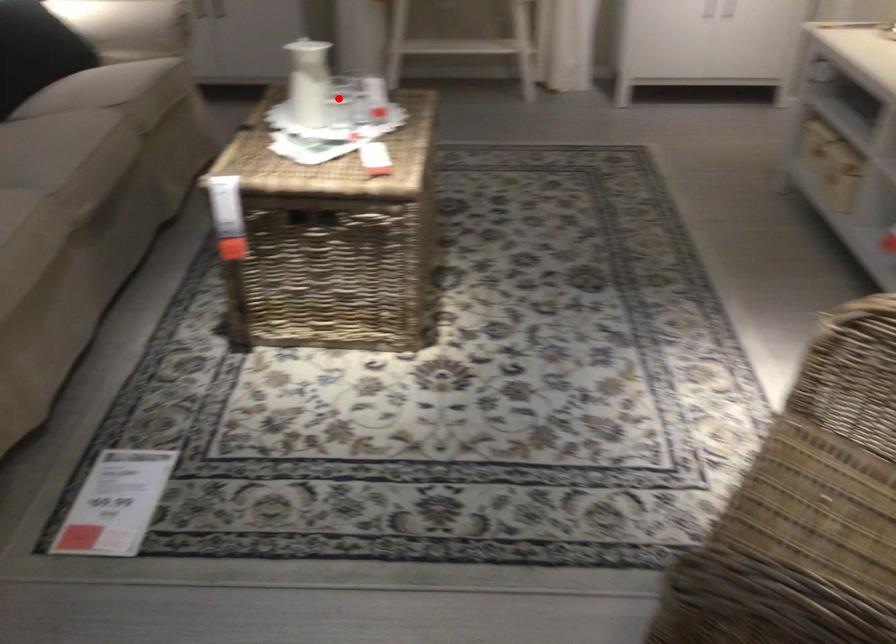
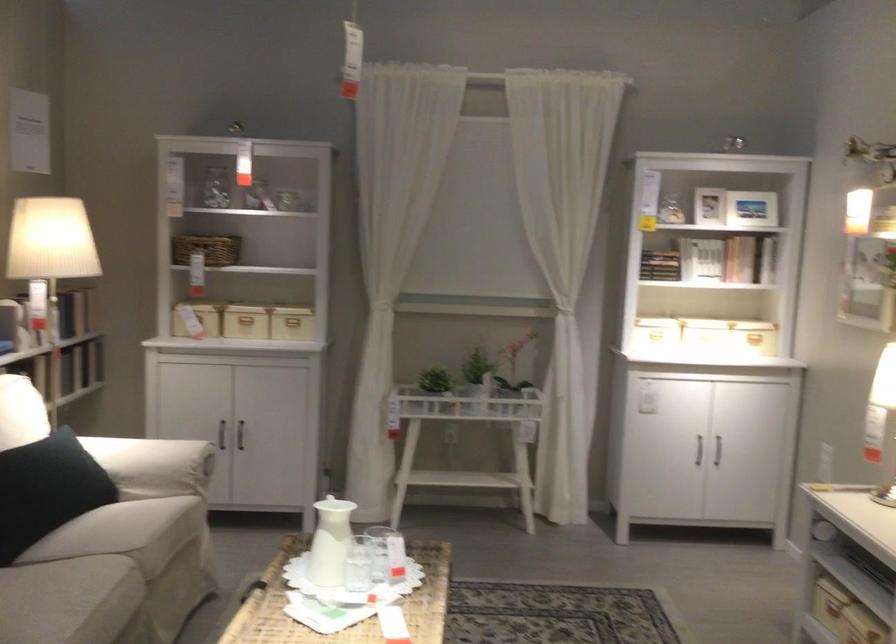
Where in the second image is the point corresponding to the highlighted location from the first image?

(358, 564)